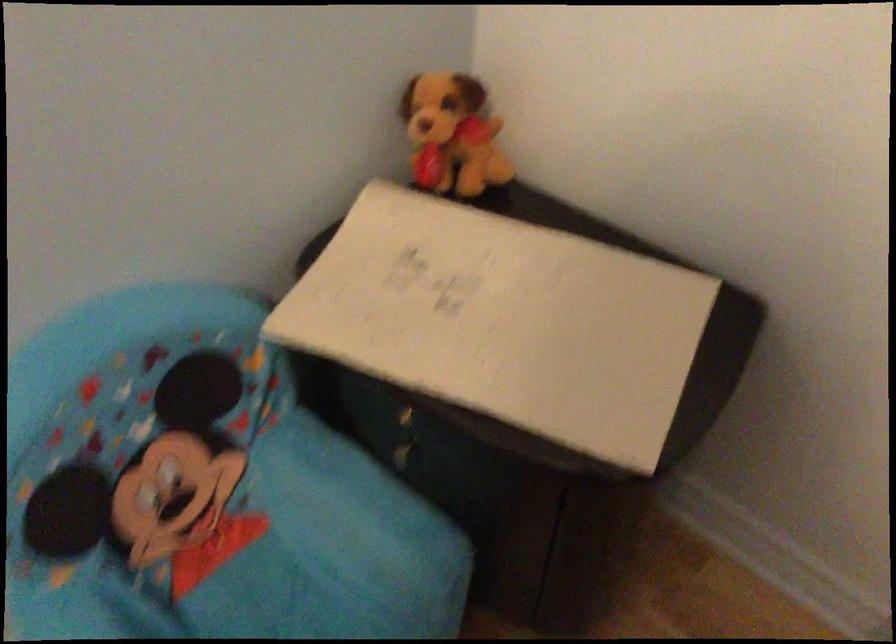
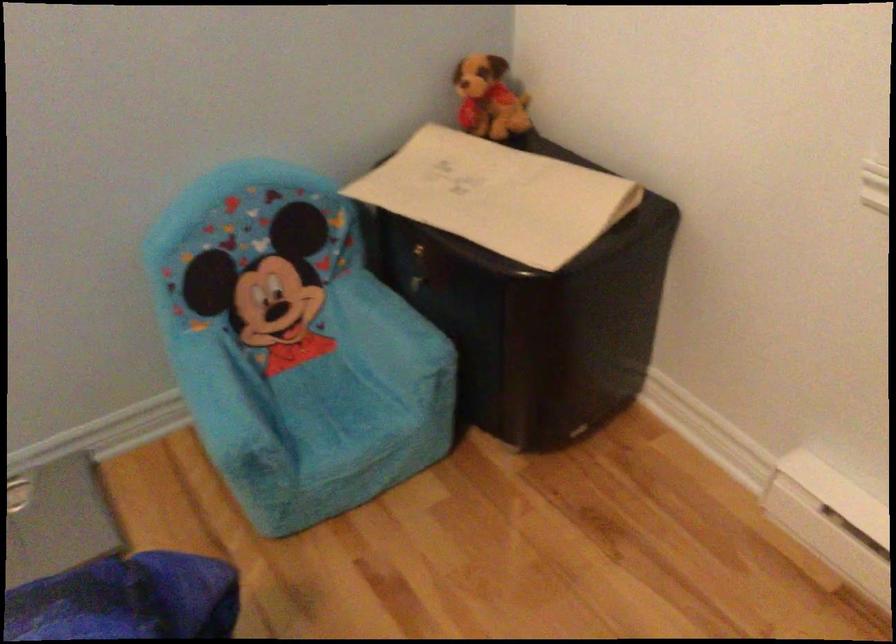
Find the pixel in the second image that matches point 407,460 in the first image.

(419, 292)